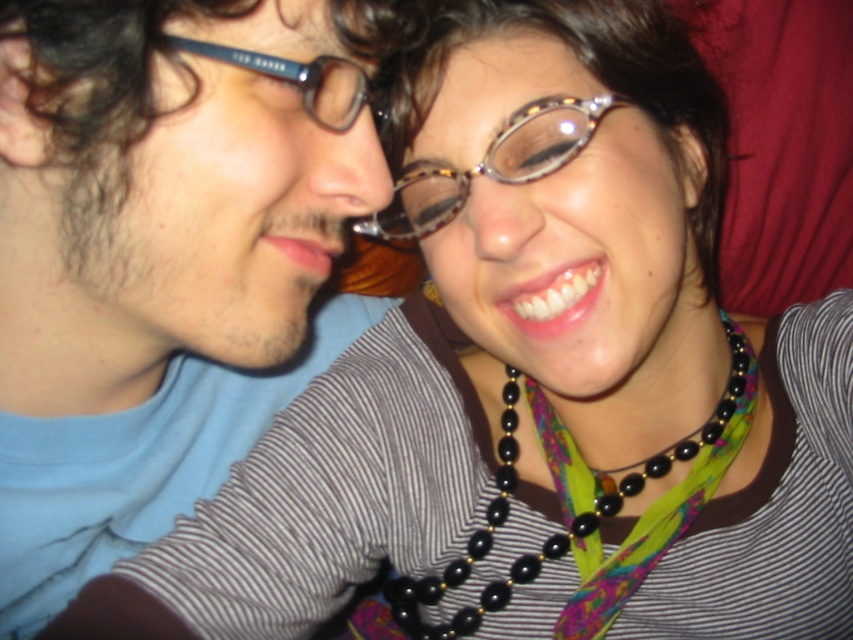
Does black beaded necklace at center have a lesser width compared to tortoiseshell acetate glasses at center?

Incorrect, black beaded necklace at center's width is not less than tortoiseshell acetate glasses at center's.

Does point (645, 547) come behind point (596, 120)?

Yes, point (645, 547) is behind point (596, 120).

Does point (514, 429) lie in front of point (553, 148)?

No.

This screenshot has width=853, height=640. What are the coordinates of `black beaded necklace at center` in the screenshot? It's located at (584, 513).

Does matte blue shirt at left appear on the left side of tortoiseshell acetate glasses at center?

Correct, you'll find matte blue shirt at left to the left of tortoiseshell acetate glasses at center.

Is matte blue shirt at left further to camera compared to tortoiseshell acetate glasses at center?

No, it is in front of tortoiseshell acetate glasses at center.

The image size is (853, 640). In order to click on matte blue shirt at left in this screenshot , I will do `click(163, 257)`.

Can you confirm if matte blue shirt at left is positioned to the right of black beaded necklace at center?

No, matte blue shirt at left is not to the right of black beaded necklace at center.

Which is in front, point (149, 284) or point (508, 436)?

Point (149, 284) is more forward.

What are the coordinates of `matte blue shirt at left` in the screenshot? It's located at (163, 257).